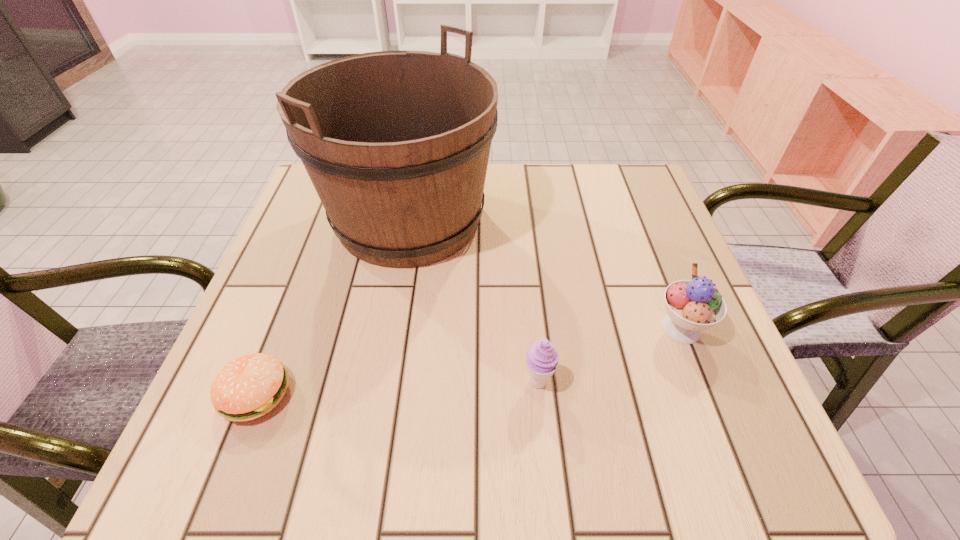
Find the location of a particular element. The width and height of the screenshot is (960, 540). vacant space that's between the shortest object and the nearer icecream is located at coordinates (396, 388).

Where is `vacant region between the shortest object and the left icecream`? vacant region between the shortest object and the left icecream is located at coordinates (396, 388).

Where is `vacant region between the left icecream and the shortest object`? This screenshot has height=540, width=960. vacant region between the left icecream and the shortest object is located at coordinates (396, 388).

Where is `blank region between the rightmost object and the nearer icecream`? blank region between the rightmost object and the nearer icecream is located at coordinates (610, 355).

In order to click on vacant area that lies between the left icecream and the rightmost object in this screenshot , I will do `click(610, 355)`.

Identify which object is the second nearest to the second object from right to left. Please provide its 2D coordinates. Your answer should be formatted as a tuple, i.e. [(x, y)], where the tuple contains the x and y coordinates of a point satisfying the conditions above.

[(396, 143)]

Image resolution: width=960 pixels, height=540 pixels. I want to click on object that stands as the third closest to the patty, so click(x=694, y=305).

The height and width of the screenshot is (540, 960). What are the coordinates of `free space that satisfies the following two spatial constraints: 1. on the back side of the shortest object; 2. on the right side of the rightmost object` in the screenshot? It's located at (281, 328).

This screenshot has width=960, height=540. I want to click on free spot that satisfies the following two spatial constraints: 1. on the back side of the bucket; 2. on the right side of the patty, so click(x=324, y=220).

This screenshot has height=540, width=960. Identify the location of free space that satisfies the following two spatial constraints: 1. on the back side of the left icecream; 2. on the right side of the farther icecream. (533, 328).